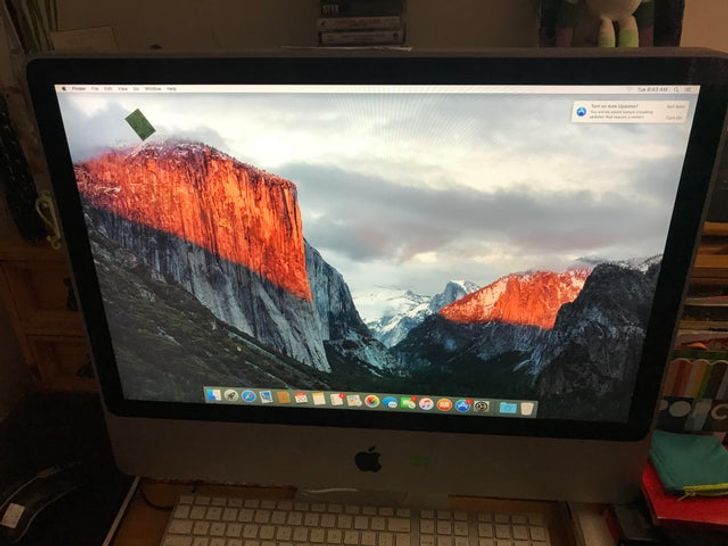
You are a GUI agent. You are given a task and a screenshot of the screen. Output one action in this format:
    pyautogui.click(x=<x>, y=<y>)
    Task: Click on the apple imac
    The height and width of the screenshot is (546, 728).
    Given the screenshot: What is the action you would take?
    pyautogui.click(x=378, y=461)